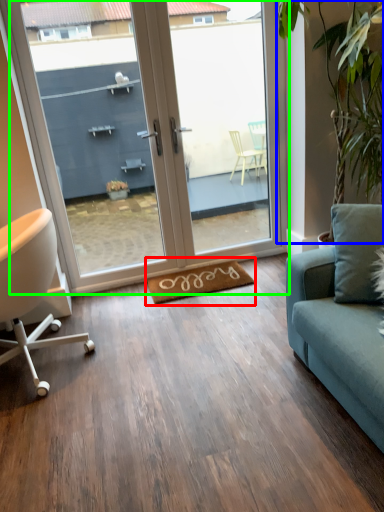
Question: Considering the real-world distances, which object is farthest from yoga mat (highlighted by a red box)? plant (highlighted by a blue box) or door (highlighted by a green box)?

Choices:
 (A) plant
 (B) door

Answer: (A)